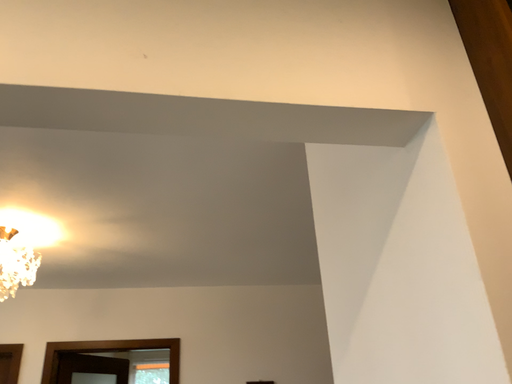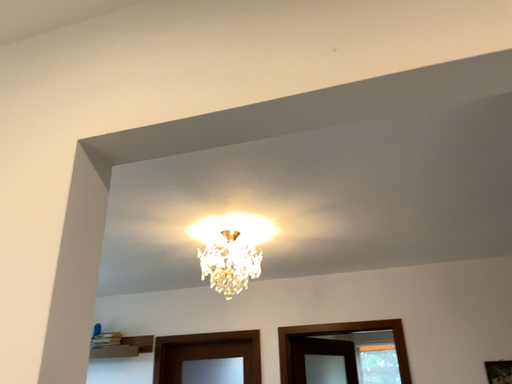
Question: How did the camera likely rotate when shooting the video?

Choices:
 (A) rotated left
 (B) rotated right

Answer: (A)